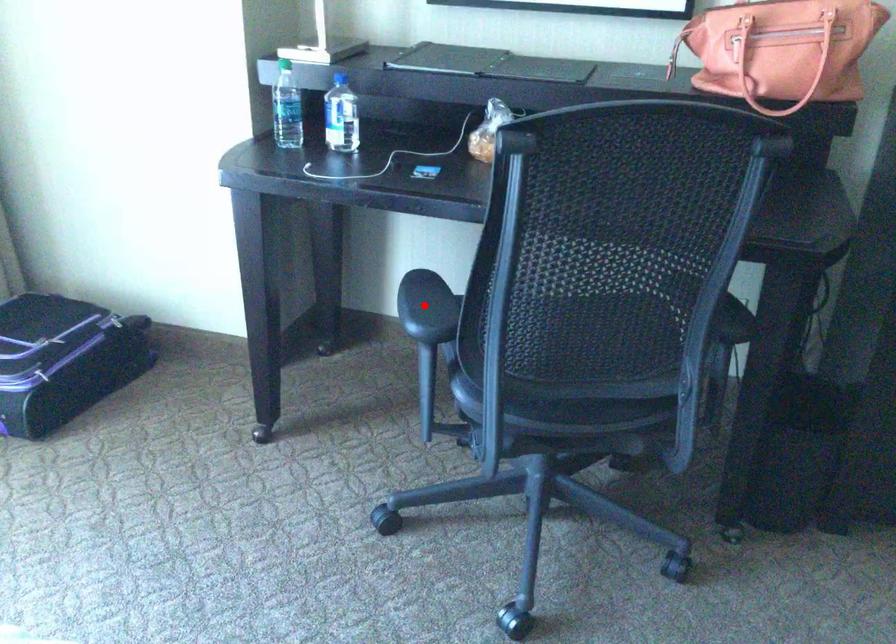
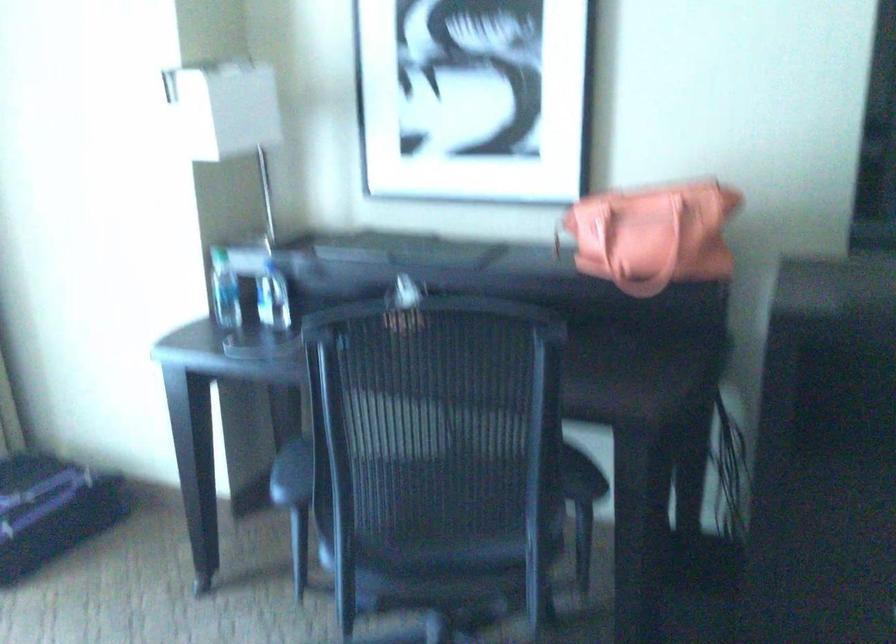
Question: I am providing you with two images of the same scene from different viewpoints. A red point is marked on the first image. Is the red point's position out of view in image 2?

Choices:
 (A) Yes
 (B) No

Answer: (B)